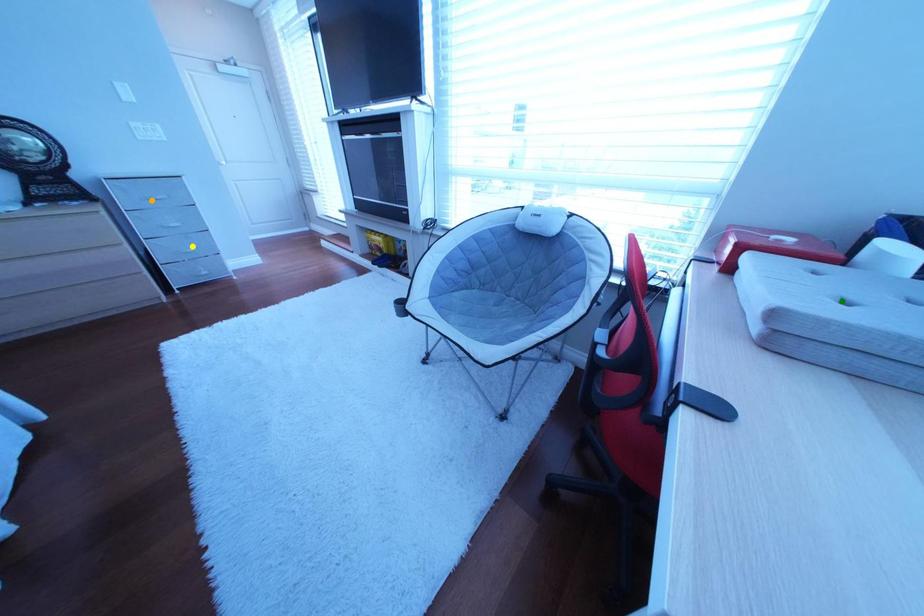
Order these from nearest to farthest:
- orange point
- green point
- yellow point

green point, orange point, yellow point